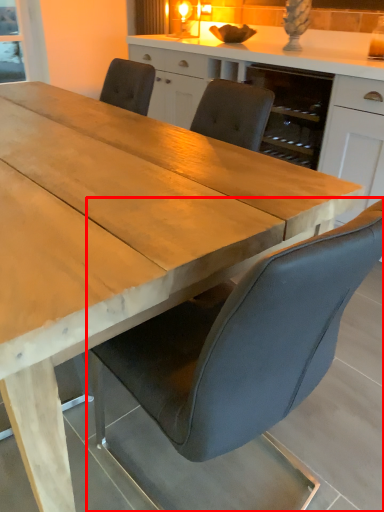
Question: Observing the image, what is the correct spatial positioning of chair (annotated by the red box) in reference to cabinetry?

Choices:
 (A) right
 (B) left

Answer: (B)